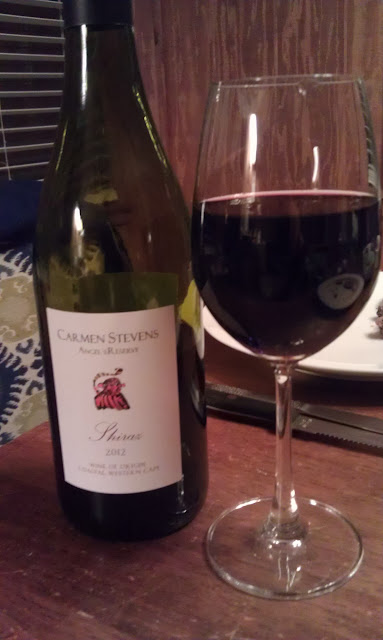
This screenshot has height=640, width=383. Find the location of `butter knife`. butter knife is located at coordinates (319, 413).